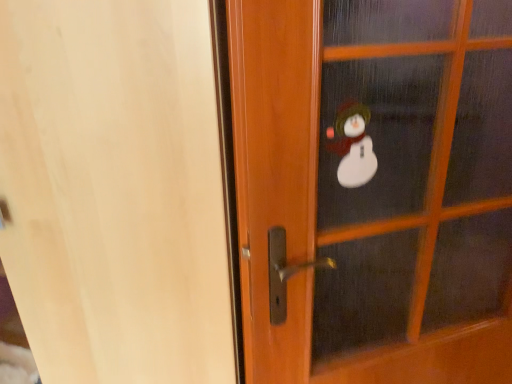
Question: Is transparent glass snowman at upper right, which is counted as the 2th screen door, starting from the right, to the right of wooden screen door at center, marked as the second screen door in a left-to-right arrangement, from the viewer's perspective?

Choices:
 (A) no
 (B) yes

Answer: (A)

Question: Is transparent glass snowman at upper right, the first screen door from the left, shorter than wooden screen door at center, marked as the second screen door in a left-to-right arrangement?

Choices:
 (A) no
 (B) yes

Answer: (A)

Question: Is the position of transparent glass snowman at upper right, the first screen door from the left, less distant than that of wooden screen door at center, which ranks as the 1th screen door in right-to-left order?

Choices:
 (A) yes
 (B) no

Answer: (A)

Question: Does transparent glass snowman at upper right, the first screen door from the left, have a greater width compared to wooden screen door at center, which ranks as the 1th screen door in right-to-left order?

Choices:
 (A) yes
 (B) no

Answer: (A)

Question: From the image's perspective, is transparent glass snowman at upper right, which is counted as the 2th screen door, starting from the right, located beneath wooden screen door at center, marked as the second screen door in a left-to-right arrangement?

Choices:
 (A) no
 (B) yes

Answer: (B)

Question: Can you confirm if transparent glass snowman at upper right, which is counted as the 2th screen door, starting from the right, is positioned to the left of wooden screen door at center, marked as the second screen door in a left-to-right arrangement?

Choices:
 (A) no
 (B) yes

Answer: (B)

Question: Is wooden screen door at center, which ranks as the 1th screen door in right-to-left order, looking in the opposite direction of transparent glass snowman at upper right, which is counted as the 2th screen door, starting from the right?

Choices:
 (A) no
 (B) yes

Answer: (A)

Question: Is wooden screen door at center, which ranks as the 1th screen door in right-to-left order, in front of transparent glass snowman at upper right, which is counted as the 2th screen door, starting from the right?

Choices:
 (A) no
 (B) yes

Answer: (A)

Question: Does wooden screen door at center, which ranks as the 1th screen door in right-to-left order, come behind transparent glass snowman at upper right, the first screen door from the left?

Choices:
 (A) yes
 (B) no

Answer: (A)

Question: Considering the relative sizes of wooden screen door at center, marked as the second screen door in a left-to-right arrangement, and transparent glass snowman at upper right, the first screen door from the left, in the image provided, is wooden screen door at center, marked as the second screen door in a left-to-right arrangement, bigger than transparent glass snowman at upper right, the first screen door from the left,?

Choices:
 (A) no
 (B) yes

Answer: (A)

Question: Considering the relative sizes of wooden screen door at center, marked as the second screen door in a left-to-right arrangement, and transparent glass snowman at upper right, which is counted as the 2th screen door, starting from the right, in the image provided, is wooden screen door at center, marked as the second screen door in a left-to-right arrangement, thinner than transparent glass snowman at upper right, which is counted as the 2th screen door, starting from the right,?

Choices:
 (A) yes
 (B) no

Answer: (A)

Question: Can transparent glass snowman at upper right, the first screen door from the left, be found inside wooden screen door at center, which ranks as the 1th screen door in right-to-left order?

Choices:
 (A) yes
 (B) no

Answer: (B)

Question: In the image, is wooden screen door at center, which ranks as the 1th screen door in right-to-left order, positioned in front of or behind transparent glass snowman at upper right, the first screen door from the left?

Choices:
 (A) behind
 (B) front

Answer: (A)